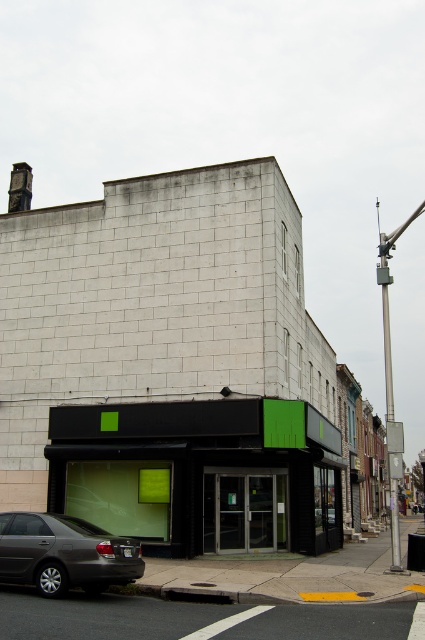
Can you confirm if black matte storefront at lower center is positioned above matte gray sedan at lower left?

No.

Does point (326, 528) come behind point (73, 545)?

Yes, it is.

Does point (260, 536) come farther from viewer compared to point (31, 520)?

Yes, it is behind point (31, 520).

Locate an element on the screen. The width and height of the screenshot is (425, 640). black matte storefront at lower center is located at coordinates (201, 474).